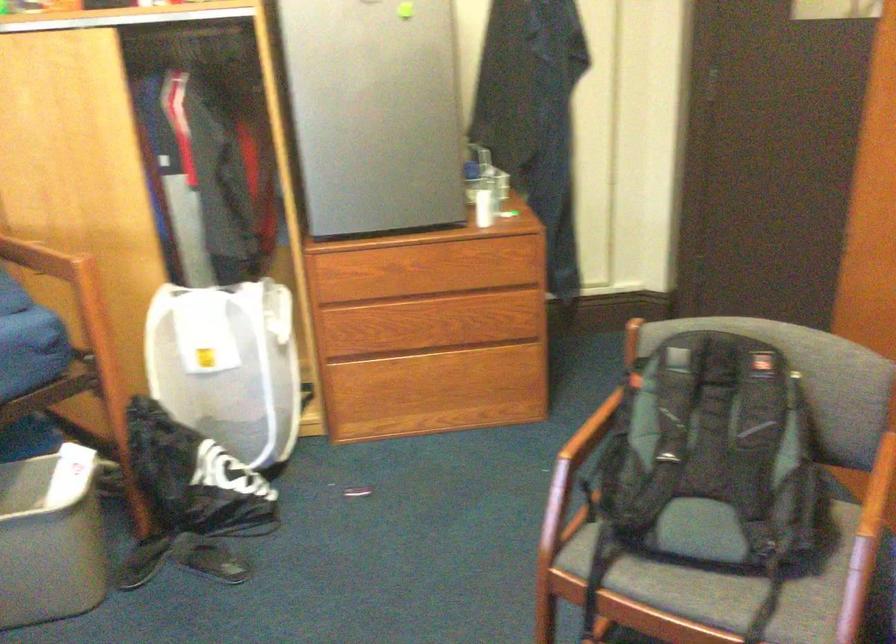
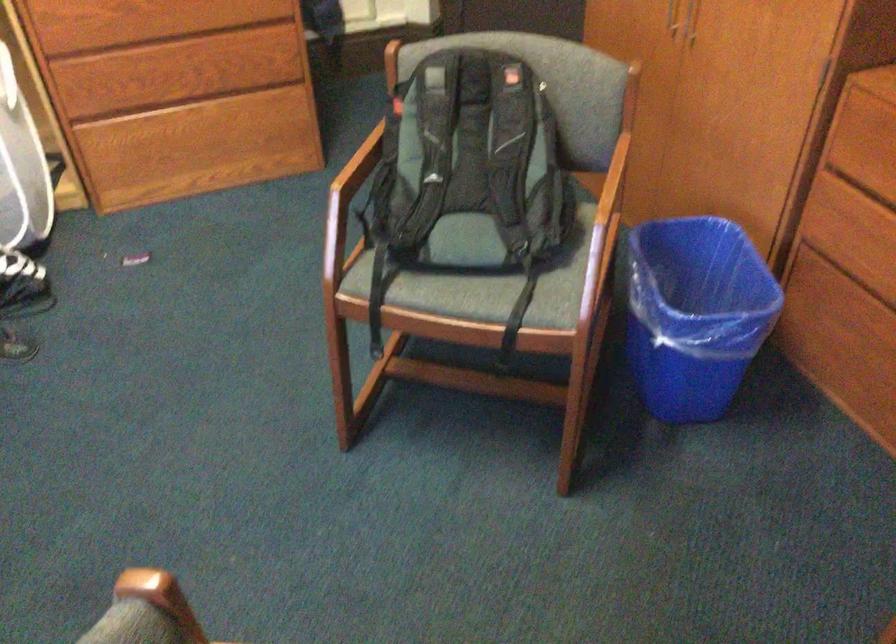
What movement of the cameraman would produce the second image?

The cameraman moved toward right, backward.